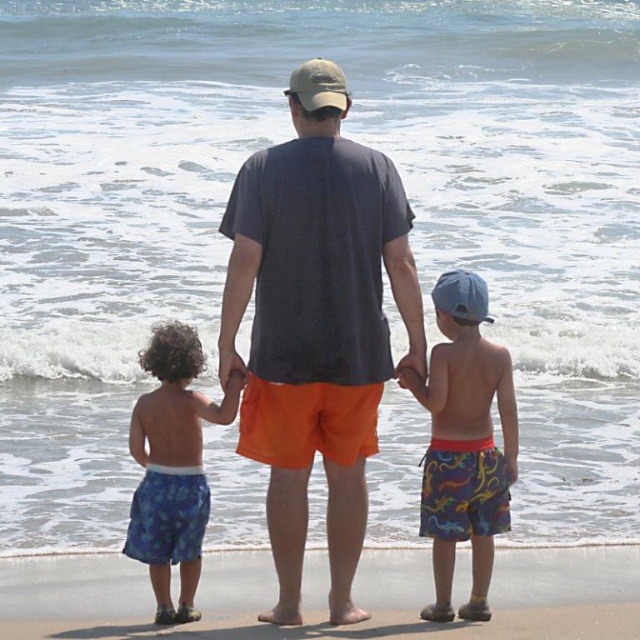
You are a photographer standing on the sandy beach at lower center and want to take a photo of the blue printed shorts at left. Which direction should you move to get a better shot?

The sandy beach at lower center is in front of the blue printed shorts at left, so you should move forward to get a better shot of the blue printed shorts at left.

You are a photographer trying to capture a candid shot of the multicolored swim trunks at center without including the blue fabric baseball cap at upper center in the frame. Based on their positions, is this possible?

The multicolored swim trunks at center is in front of the blue fabric baseball cap at upper center, so it is possible to capture the multicolored swim trunks at center without including the blue fabric baseball cap at upper center by focusing on the lower part of the scene where the swim trunks are positioned, excluding the upper area where the cap is located.